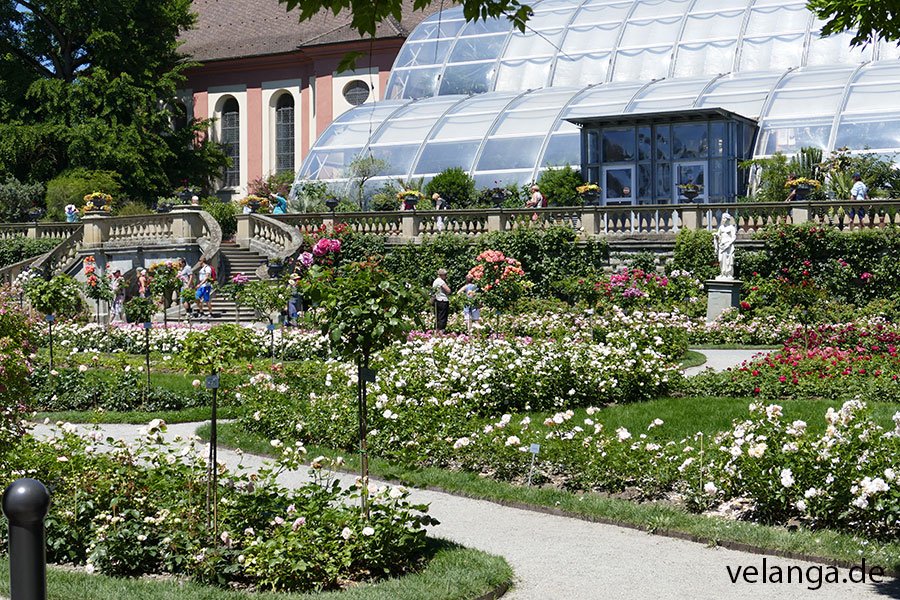
You are a GUI agent. You are given a task and a screenshot of the screen. Output one action in this format:
    pyautogui.click(x=<x>, y=<y>)
    Task: Click on the door
    This screenshot has height=600, width=900.
    Given the screenshot: What is the action you would take?
    tap(609, 184), tap(688, 192)